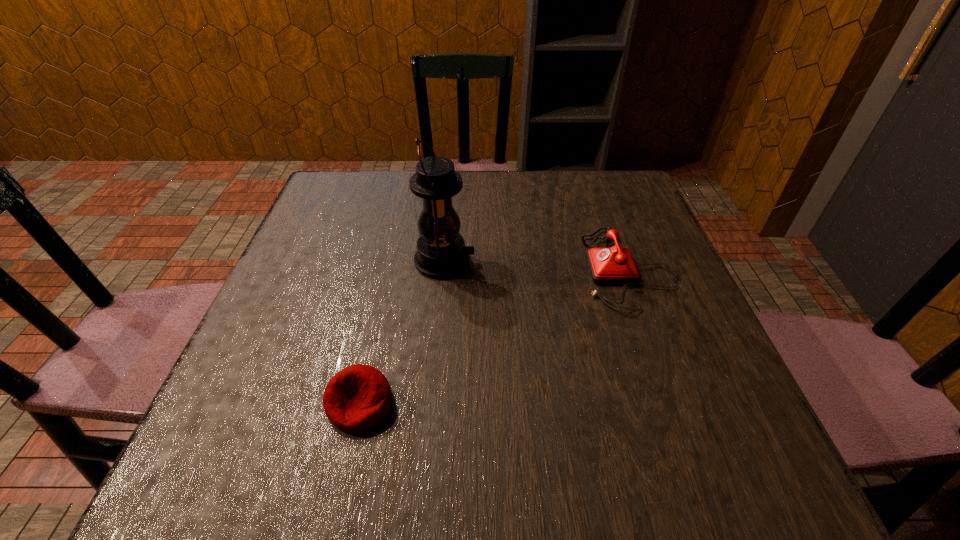
This screenshot has height=540, width=960. Find the location of `lantern`. lantern is located at coordinates (441, 253).

Find the location of a particular element. The width and height of the screenshot is (960, 540). the second tallest object is located at coordinates (614, 265).

Image resolution: width=960 pixels, height=540 pixels. Identify the location of the rightmost object. (614, 265).

Image resolution: width=960 pixels, height=540 pixels. Find the location of `the shortest object`. the shortest object is located at coordinates (357, 398).

Locate an element on the screen. the nearest object is located at coordinates (357, 398).

Where can I find a free point located 0.240m above the lantern, indicating its light source? Please provide its 2D coordinates. Your answer should be formatted as a tuple, i.e. [(x, y)], where the tuple contains the x and y coordinates of a point satisfying the conditions above.

[(583, 261)]

The height and width of the screenshot is (540, 960). I want to click on free space located 0.090m on the dial of the rightmost object, so click(541, 269).

This screenshot has height=540, width=960. Find the location of `vacant space located 0.120m on the dial of the rightmost object`. vacant space located 0.120m on the dial of the rightmost object is located at coordinates (528, 269).

This screenshot has width=960, height=540. In order to click on vacant space located 0.220m on the dial of the rightmost object in this screenshot , I will do `click(482, 269)`.

At what (x,y) coordinates should I click in order to perform the action: click on vacant space positioned 0.060m on the seat area of the nearest object. Please return your answer as a coordinate pair (x, y). This screenshot has width=960, height=540. Looking at the image, I should click on (345, 473).